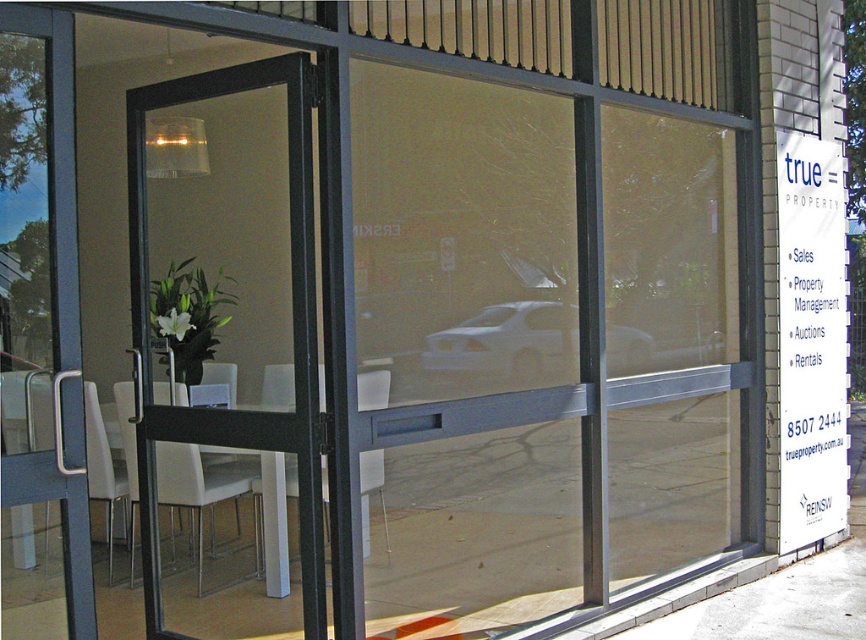
Question: Can you confirm if black glass screen door at center is positioned above white plastic chair at center?

Choices:
 (A) no
 (B) yes

Answer: (B)

Question: Does black glass screen door at center appear on the right side of white plastic chair at center?

Choices:
 (A) no
 (B) yes

Answer: (A)

Question: Is black glass screen door at center thinner than white plastic chair at center?

Choices:
 (A) no
 (B) yes

Answer: (A)

Question: Which object is farther from the camera taking this photo?

Choices:
 (A) white plastic chair at center
 (B) black glass screen door at center

Answer: (B)

Question: Which point is closer to the camera?

Choices:
 (A) (186, 477)
 (B) (189, 99)

Answer: (B)